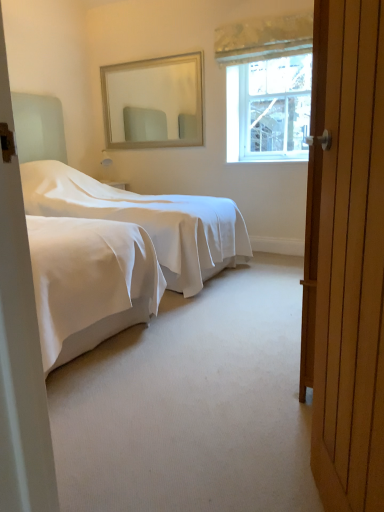
The image size is (384, 512). In order to click on blank space above beige framed mirror at upper center (from a real-world perspective) in this screenshot , I will do `click(149, 55)`.